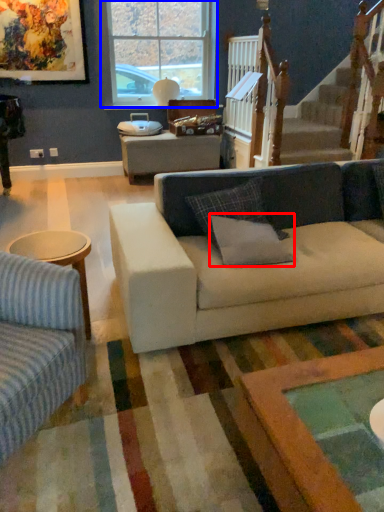
Question: Among these objects, which one is nearest to the camera, pillow (highlighted by a red box) or window (highlighted by a blue box)?

Choices:
 (A) pillow
 (B) window

Answer: (A)